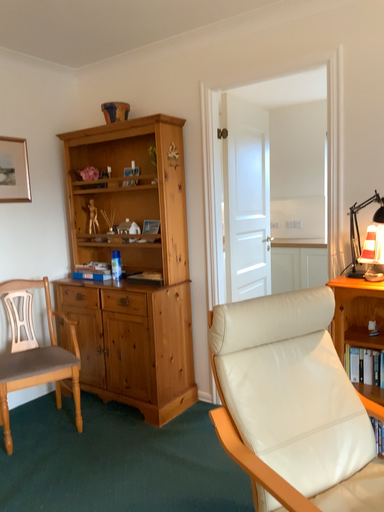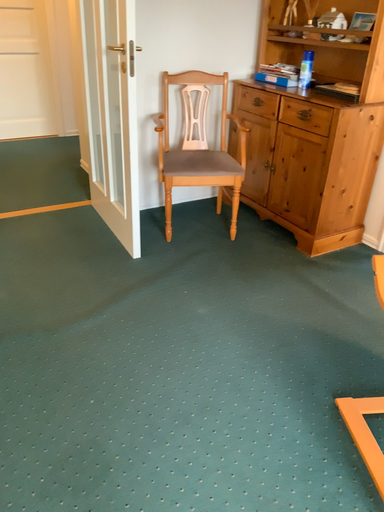
Question: Which way did the camera rotate in the video?

Choices:
 (A) rotated downward
 (B) rotated upward

Answer: (A)